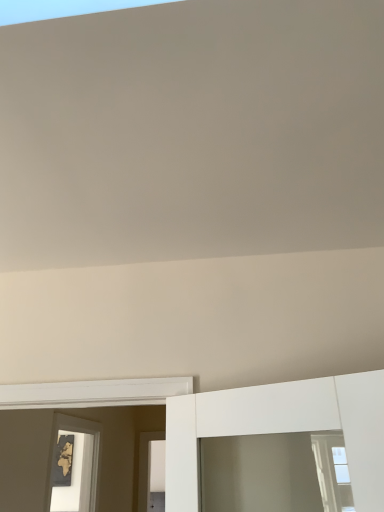
The image size is (384, 512). Describe the element at coordinates (78, 466) in the screenshot. I see `wooden framed map at left` at that location.

This screenshot has height=512, width=384. Find the location of `wooden framed map at left`. wooden framed map at left is located at coordinates (78, 466).

Measure the distance between point (91, 465) and camera.

Point (91, 465) and camera are 3.60 meters apart.

Find the location of a particular element. The image size is (384, 512). wooden framed map at left is located at coordinates (78, 466).